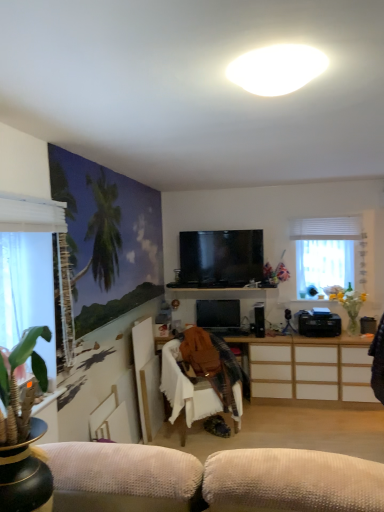
This screenshot has height=512, width=384. Identify the location of white sheer curtain at right, acting as the second window starting from the left. [x=328, y=253].

What do you see at coordinates (323, 265) in the screenshot? I see `white sheer curtain at right` at bounding box center [323, 265].

What do you see at coordinates (319, 325) in the screenshot? I see `black plastic printer at lower right` at bounding box center [319, 325].

This screenshot has width=384, height=512. Describe the element at coordinates (277, 69) in the screenshot. I see `white matte oval light at upper center` at that location.

Where is `white sheer curtain at right, the first window when ordered from back to front`? white sheer curtain at right, the first window when ordered from back to front is located at coordinates (328, 253).

Considering the relative positions of flat screen tv at center, marked as the 2th television in a bottom-to-top arrangement, and white wood cabinet at center in the image provided, is flat screen tv at center, marked as the 2th television in a bottom-to-top arrangement, behind white wood cabinet at center?

That is True.

Is flat screen tv at center, marked as the 2th television in a bottom-to-top arrangement, not inside white wood cabinet at center?

Yes.

From a real-world perspective, is flat screen tv at center, marked as the 2th television in a bottom-to-top arrangement, positioned above or below white wood cabinet at center?

Clearly, from a real-world perspective, flat screen tv at center, marked as the 2th television in a bottom-to-top arrangement, is above white wood cabinet at center.

Are flat screen tv at center, the first television from the top, and white wood cabinet at center beside each other?

No, flat screen tv at center, the first television from the top, is not making contact with white wood cabinet at center.

In terms of height, does white fabric chair at center look taller or shorter compared to white matte oval light at upper center?

white fabric chair at center is taller than white matte oval light at upper center.

Based on the photo, from a real-world perspective, which is physically below, white fabric chair at center or white matte oval light at upper center?

white fabric chair at center, from a real-world perspective.

Is white matte oval light at upper center at the back of white fabric chair at center?

That's not correct — white fabric chair at center is not looking away from white matte oval light at upper center.

In the scene shown: Is white matte oval light at upper center located within white fabric chair at center?

No.

Is matte black tv at center, acting as the first television starting from the bottom, situated inside white sheer curtain at left, positioned as the first window in left-to-right order, or outside?

matte black tv at center, acting as the first television starting from the bottom, is outside white sheer curtain at left, positioned as the first window in left-to-right order.

Is matte black tv at center, acting as the first television starting from the bottom, to the left of white sheer curtain at left, placed as the second window when sorted from right to left, from the viewer's perspective?

Incorrect, matte black tv at center, acting as the first television starting from the bottom, is not on the left side of white sheer curtain at left, placed as the second window when sorted from right to left.

Who is bigger, matte black tv at center, the second television from the top, or white sheer curtain at left, placed as the second window when sorted from right to left?

white sheer curtain at left, placed as the second window when sorted from right to left, is bigger.

From their relative heights in the image, would you say matte black tv at center, the second television from the top, is taller or shorter than white sheer curtain at left, placed as the second window when sorted from right to left?

matte black tv at center, the second television from the top, is shorter than white sheer curtain at left, placed as the second window when sorted from right to left.

Would you say translucent glass vase at right is outside white matte oval light at upper center?

Absolutely, translucent glass vase at right is external to white matte oval light at upper center.

From the image's perspective, between translucent glass vase at right and white matte oval light at upper center, who is located below?

translucent glass vase at right appears lower in the image.

Between point (353, 301) and point (261, 72), which one is positioned behind?

Point (353, 301)

Is translucent glass vase at right facing away from white matte oval light at upper center?

No, translucent glass vase at right is not facing away from white matte oval light at upper center.

From the image's perspective, is white sheer curtain at left, the second window viewed from the back, on white wood cabinet at center?

Yes, from the image's perspective, white sheer curtain at left, the second window viewed from the back, is over white wood cabinet at center.

Does white sheer curtain at left, the second window viewed from the back, touch white wood cabinet at center?

white sheer curtain at left, the second window viewed from the back, and white wood cabinet at center are clearly separated.

Which is in front, point (24, 231) or point (325, 395)?

Positioned in front is point (24, 231).

Is white sheer curtain at left, positioned as the first window in left-to-right order, at the left side of white wood cabinet at center?

Correct, you'll find white sheer curtain at left, positioned as the first window in left-to-right order, to the left of white wood cabinet at center.

In the image, there is a white fabric chair at center. At what (x,y) coordinates should I click in order to perform the action: click on cabinetry below it (from the image's perspective). Please return your answer as a coordinate pair (x, y). Looking at the image, I should click on (308, 369).

Considering the relative sizes of white wood cabinet at center and white fabric chair at center in the image provided, is white wood cabinet at center bigger than white fabric chair at center?

Yes.

Between point (254, 388) and point (237, 425), which one is positioned in front?

Point (237, 425)

Considering the positions of objects white wood cabinet at center and white fabric chair at center in the image provided, who is more to the right, white wood cabinet at center or white fabric chair at center?

From the viewer's perspective, white wood cabinet at center appears more on the right side.

Who is smaller, black plastic printer at lower right or white fabric chair at center?

Smaller between the two is black plastic printer at lower right.

From the image's perspective, is black plastic printer at lower right on top of white fabric chair at center?

Yes, from the image's perspective, black plastic printer at lower right is over white fabric chair at center.

Could white fabric chair at center be considered to be inside black plastic printer at lower right?

Actually, white fabric chair at center is outside black plastic printer at lower right.

From a real-world perspective, which is physically above, black plastic printer at lower right or white fabric chair at center?

In real-world perspective, black plastic printer at lower right is above.

Locate an element on the screen. The image size is (384, 512). cabinetry located underneath the flat screen tv at center, marked as the 2th television in a bottom-to-top arrangement (from a real-world perspective) is located at coordinates (308, 369).

Image resolution: width=384 pixels, height=512 pixels. What are the coordinates of `lamp located above the white fabric chair at center (from the image's perspective)` in the screenshot? It's located at (277, 69).

Consider the image. Based on their spatial positions, is matte black tv at center, acting as the first television starting from the bottom, or translucent glass vase at right further from white matte oval light at upper center?

translucent glass vase at right lies further to white matte oval light at upper center than the other object.

When comparing their distances from black plastic speaker at center, does white sheer curtain at right or white sheer curtain at left, which ranks as the first window in front-to-back order, seem closer?

white sheer curtain at right is positioned closer to the anchor black plastic speaker at center.

Estimate the real-world distances between objects in this image. Which object is closer to white matte oval light at upper center, black plastic printer at lower right or white sheer curtain at right, the 1th window positioned from the right?

white sheer curtain at right, the 1th window positioned from the right, is positioned closer to the anchor white matte oval light at upper center.

Based on the photo, looking at the image, which one is located further to white matte oval light at upper center, white fabric chair at center or translucent glass vase at right?

Based on the image, translucent glass vase at right appears to be further to white matte oval light at upper center.

Considering their positions, is matte black tv at center, acting as the first television starting from the bottom, positioned closer to white sheer curtain at left, the second window viewed from the back, than white matte oval light at upper center?

white matte oval light at upper center is positioned closer to the anchor white sheer curtain at left, the second window viewed from the back.

Which object lies further to the anchor point white sheer curtain at right, the first window when ordered from back to front, flat screen tv at center, the first television from the top, or white matte oval light at upper center?

white matte oval light at upper center.

Considering their positions, is white matte oval light at upper center positioned closer to translucent glass vase at right than flat screen tv at center, marked as the 2th television in a bottom-to-top arrangement?

flat screen tv at center, marked as the 2th television in a bottom-to-top arrangement, is positioned closer to the anchor translucent glass vase at right.

Looking at this image, from the image, which object appears to be farther from flat screen tv at center, marked as the 2th television in a bottom-to-top arrangement, white wood cabinet at center or white sheer curtain at right?

white wood cabinet at center is positioned further to the anchor flat screen tv at center, marked as the 2th television in a bottom-to-top arrangement.

Identify the location of cabinetry located between white matte oval light at upper center and flat screen tv at center, the first television from the top, in the depth direction. Image resolution: width=384 pixels, height=512 pixels. pos(308,369).

At what (x,y) coordinates should I click in order to perform the action: click on cabinetry between matte black tv at center, acting as the first television starting from the bottom, and translucent glass vase at right. Please return your answer as a coordinate pair (x, y). This screenshot has width=384, height=512. Looking at the image, I should click on (308, 369).

This screenshot has height=512, width=384. I want to click on appliance between white sheer curtain at right, the first window when ordered from back to front, and white wood cabinet at center, in the vertical direction, so click(x=319, y=325).

This screenshot has height=512, width=384. What are the coordinates of `television between white matte oval light at upper center and matte black tv at center, acting as the first television starting from the bottom, in the front-back direction` in the screenshot? It's located at (220, 258).